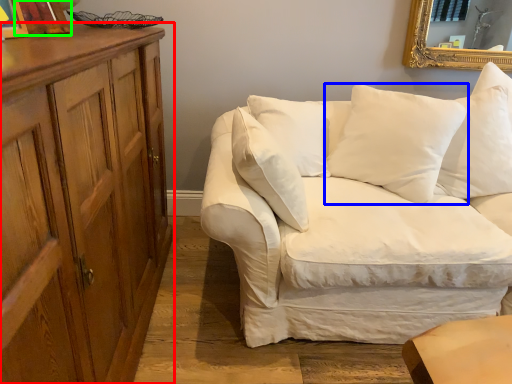
Question: Estimate the real-world distances between objects in this image. Which object is closer to cabinetry (highlighted by a red box), pillow (highlighted by a blue box) or picture frame (highlighted by a green box)?

Choices:
 (A) pillow
 (B) picture frame

Answer: (B)